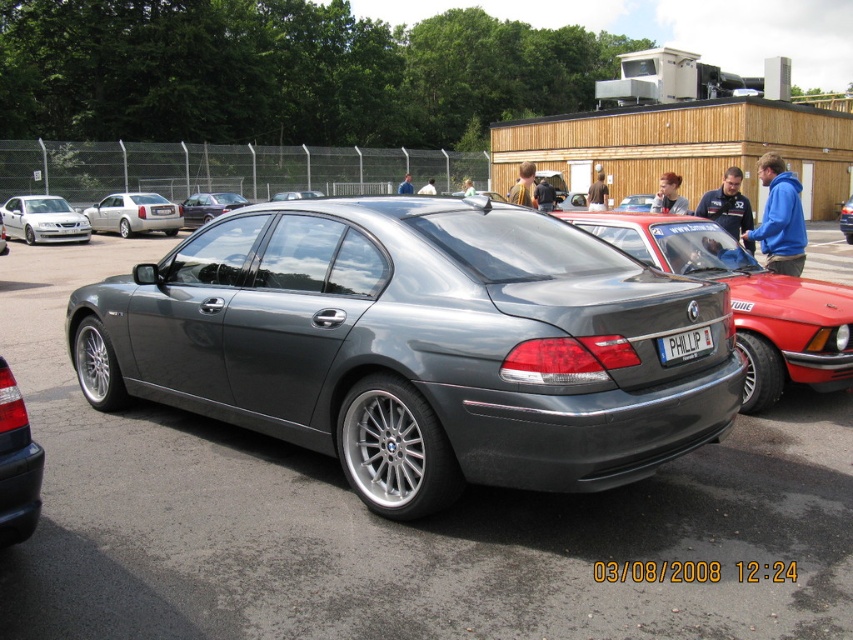
Question: Which of the following is the closest to the observer?

Choices:
 (A) (100, 227)
 (B) (846, 205)
 (C) (45, 211)
 (D) (229, 204)

Answer: (C)

Question: Does satin metallic sedan at center come behind black glossy tail light at lower left?

Choices:
 (A) yes
 (B) no

Answer: (A)

Question: Does black glossy tail light at lower left lie in front of matte silver sedan at left?

Choices:
 (A) no
 (B) yes

Answer: (B)

Question: Which point is farther to the camera?

Choices:
 (A) (0, 522)
 (B) (660, 346)
 (C) (811, 280)

Answer: (C)

Question: Is satin metallic sedan at center to the left of satin metallic car at center from the viewer's perspective?

Choices:
 (A) yes
 (B) no

Answer: (B)

Question: Which object is closer to the camera taking this photo?

Choices:
 (A) matte silver sedan at left
 (B) silver metallic sedan at left
 (C) metallic gray sedan at center

Answer: (C)